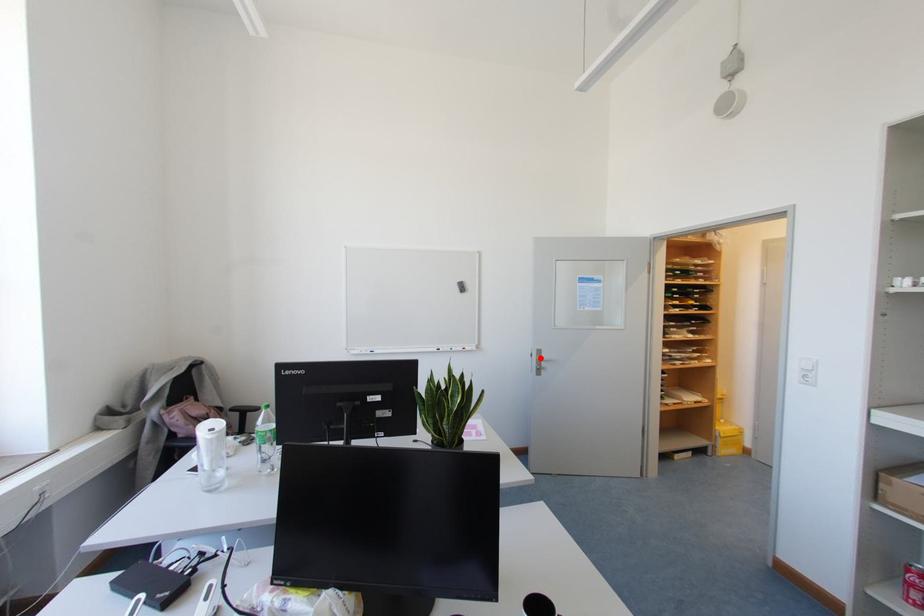
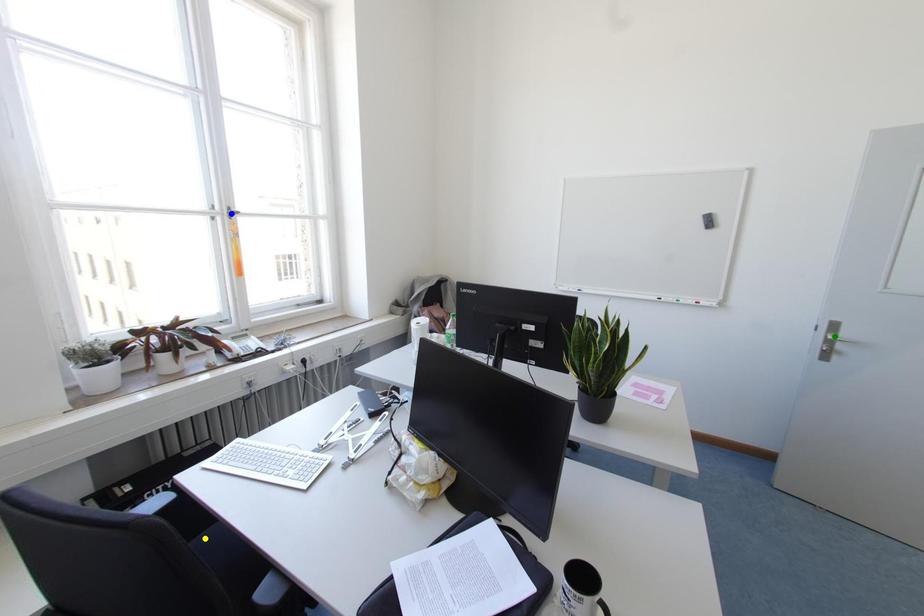
Question: I am providing you with two images of the same scene from different viewpoints. A red point is marked on the first image. You are given multiple points on the second image. Which point in image 2 is actually the same real-world point as the red point in image 1?

Choices:
 (A) green point
 (B) blue point
 (C) yellow point

Answer: (A)